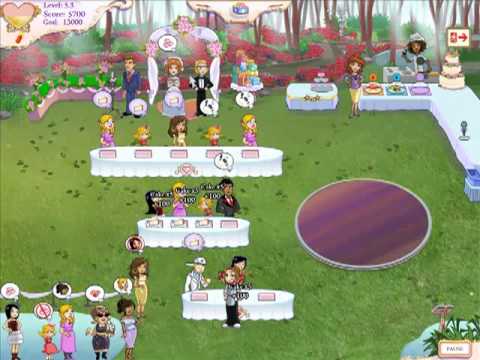
Locate an element on the screen. Image resolution: width=480 pixels, height=360 pixels. rightmost table is located at coordinates (450, 109).